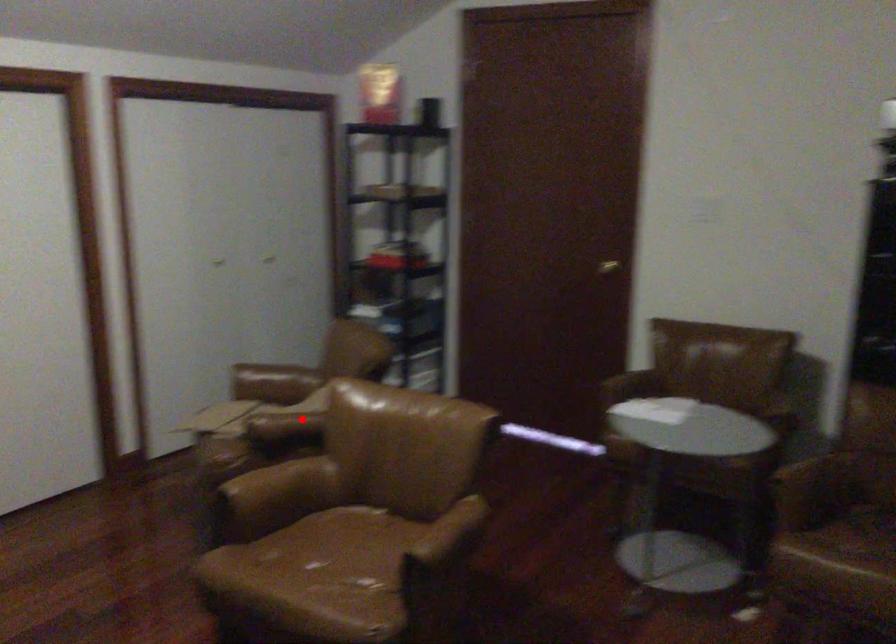
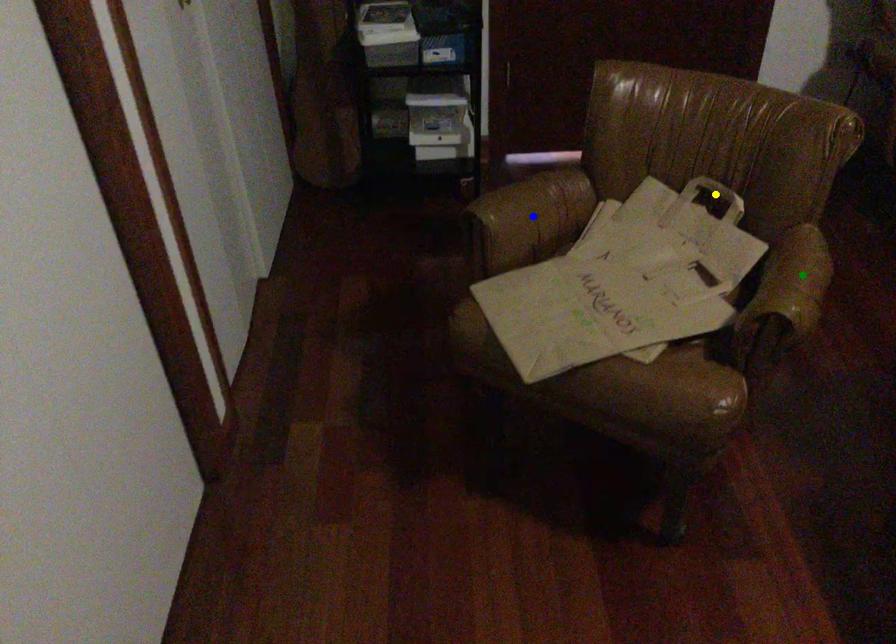
Question: I am providing you with two images of the same scene from different viewpoints. A red point is marked on the first image. You are given multiple points on the second image. Which mark in image 2 goes with the point in image 1?

Choices:
 (A) green point
 (B) blue point
 (C) yellow point

Answer: (A)